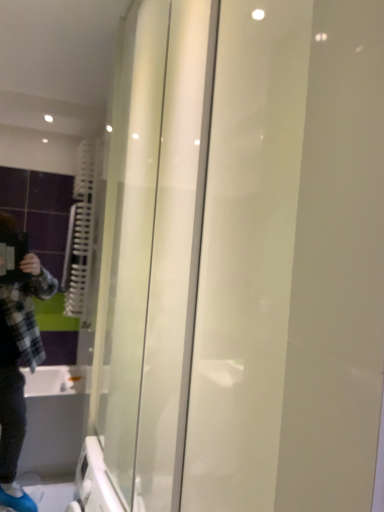
Where is `white glossy shower door at center`? white glossy shower door at center is located at coordinates (205, 257).

Describe the element at coordinates (205, 257) in the screenshot. I see `white glossy shower door at center` at that location.

In order to face white glossy shower door at center, should I rotate leftwards or rightwards?

Rotate right and turn 4.835 degrees.

Locate an element on the screen. white glossy shower door at center is located at coordinates (205, 257).